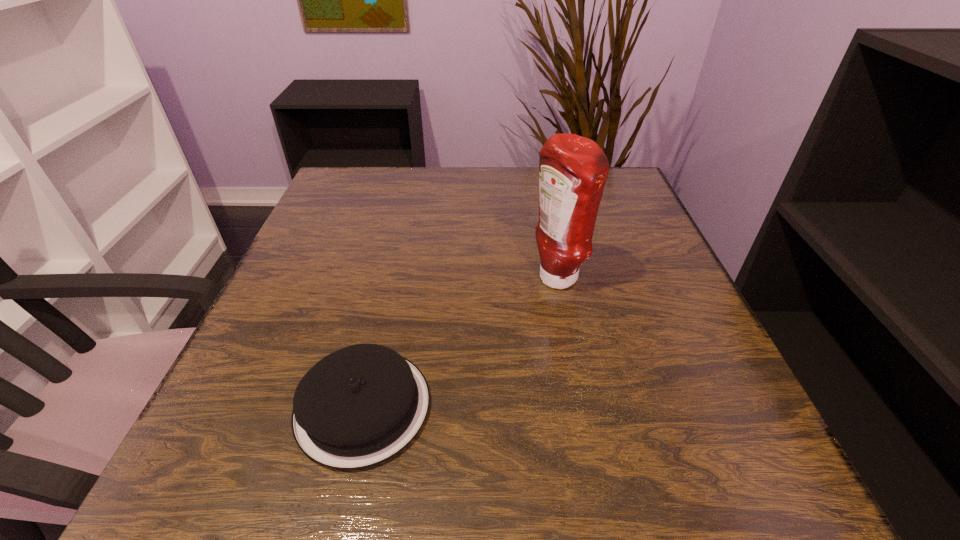
What are the coordinates of `vacant space at the left edge` in the screenshot? It's located at (288, 285).

In the image, there is a desktop. In order to click on free space at the right edge in this screenshot , I will do `click(660, 306)`.

Find the location of a particular element. The height and width of the screenshot is (540, 960). vacant space at the far left corner is located at coordinates (381, 203).

I want to click on vacant space at the far right corner, so click(610, 183).

This screenshot has width=960, height=540. In order to click on vacant space at the near right corner in this screenshot , I will do `click(711, 461)`.

Where is `free location that satisfies the following two spatial constraints: 1. on the back side of the shorter object; 2. on the left side of the farther object`? The height and width of the screenshot is (540, 960). free location that satisfies the following two spatial constraints: 1. on the back side of the shorter object; 2. on the left side of the farther object is located at coordinates (392, 280).